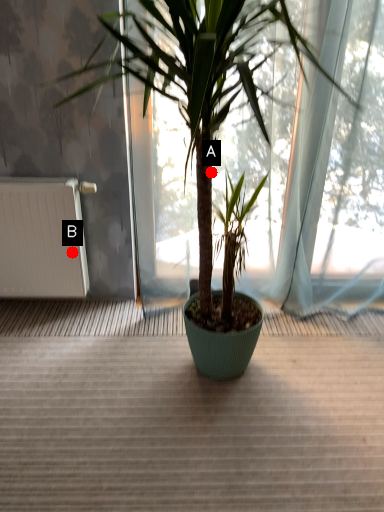
Question: Two points are circled on the image, labeled by A and B beside each circle. Among these points, which one is farthest from the camera?

Choices:
 (A) A is further
 (B) B is further

Answer: (B)